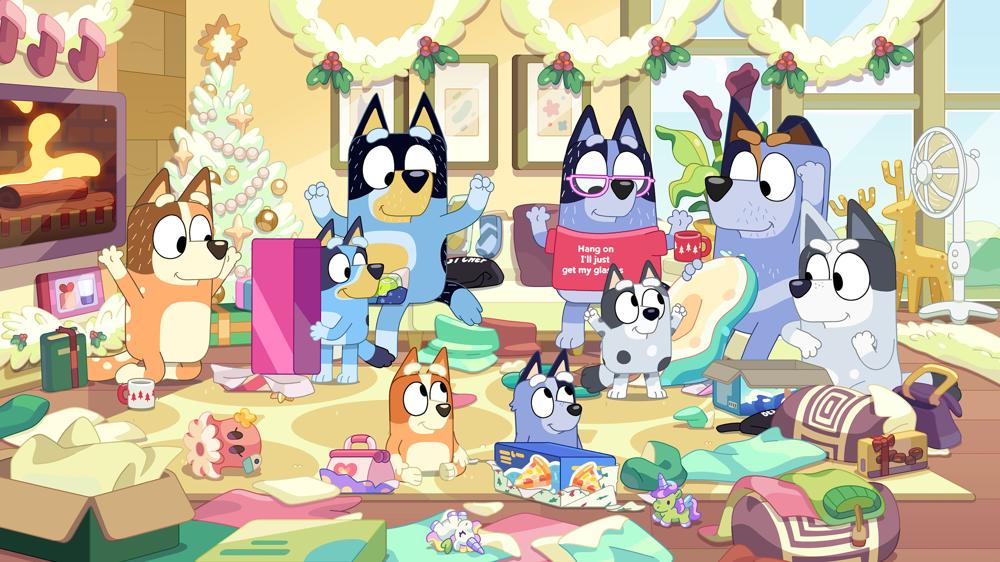
The image size is (1000, 562). Identify the location of book. (70, 365).